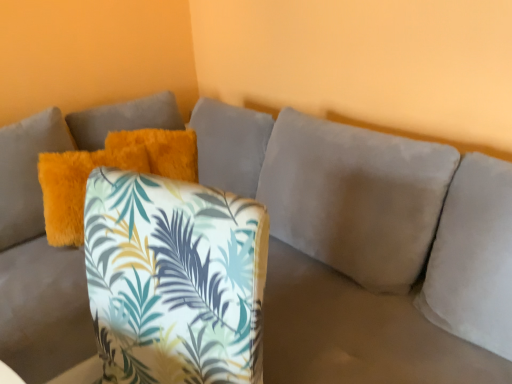
Question: Can we say printed fabric cushion at center lies outside fluffy orange pillow at upper left?

Choices:
 (A) yes
 (B) no

Answer: (A)

Question: Is printed fabric cushion at center oriented towards fluffy orange pillow at upper left?

Choices:
 (A) yes
 (B) no

Answer: (B)

Question: Can you confirm if printed fabric cushion at center is wider than fluffy orange pillow at upper left?

Choices:
 (A) yes
 (B) no

Answer: (A)

Question: From a real-world perspective, is printed fabric cushion at center physically above fluffy orange pillow at upper left?

Choices:
 (A) yes
 (B) no

Answer: (B)

Question: From the image's perspective, would you say printed fabric cushion at center is shown under fluffy orange pillow at upper left?

Choices:
 (A) no
 (B) yes

Answer: (B)

Question: Does printed fabric cushion at center lie in front of fluffy orange pillow at upper left?

Choices:
 (A) yes
 (B) no

Answer: (A)

Question: Can you confirm if fluffy orange pillow at upper left is positioned to the right of printed fabric cushion at center?

Choices:
 (A) no
 (B) yes

Answer: (A)

Question: Is fluffy orange pillow at upper left far from printed fabric cushion at center?

Choices:
 (A) no
 (B) yes

Answer: (A)

Question: Is fluffy orange pillow at upper left shorter than printed fabric cushion at center?

Choices:
 (A) yes
 (B) no

Answer: (A)

Question: Is fluffy orange pillow at upper left completely or partially outside of printed fabric cushion at center?

Choices:
 (A) yes
 (B) no

Answer: (A)

Question: From a real-world perspective, is fluffy orange pillow at upper left positioned under printed fabric cushion at center based on gravity?

Choices:
 (A) yes
 (B) no

Answer: (B)

Question: Is printed fabric cushion at center located within fluffy orange pillow at upper left?

Choices:
 (A) no
 (B) yes

Answer: (A)

Question: In the image, is fluffy orange pillow at upper left on the left side or the right side of printed fabric cushion at center?

Choices:
 (A) left
 (B) right

Answer: (A)